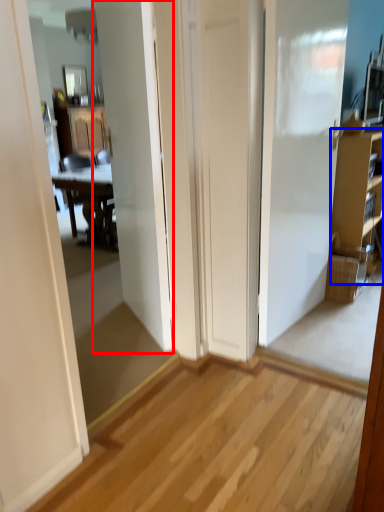
Question: Which of the following is the closest to the observer, door (highlighted by a red box) or cabinetry (highlighted by a blue box)?

Choices:
 (A) door
 (B) cabinetry

Answer: (A)